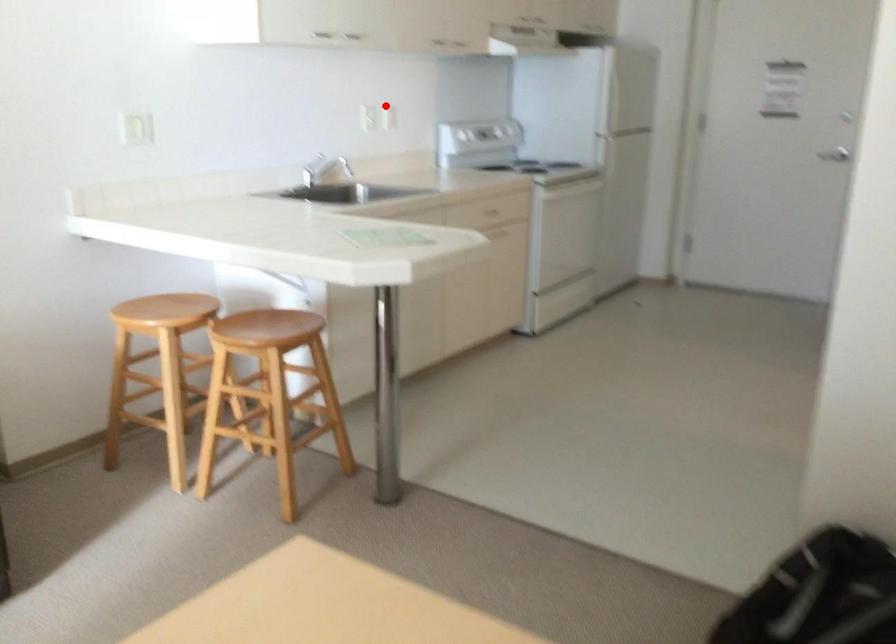
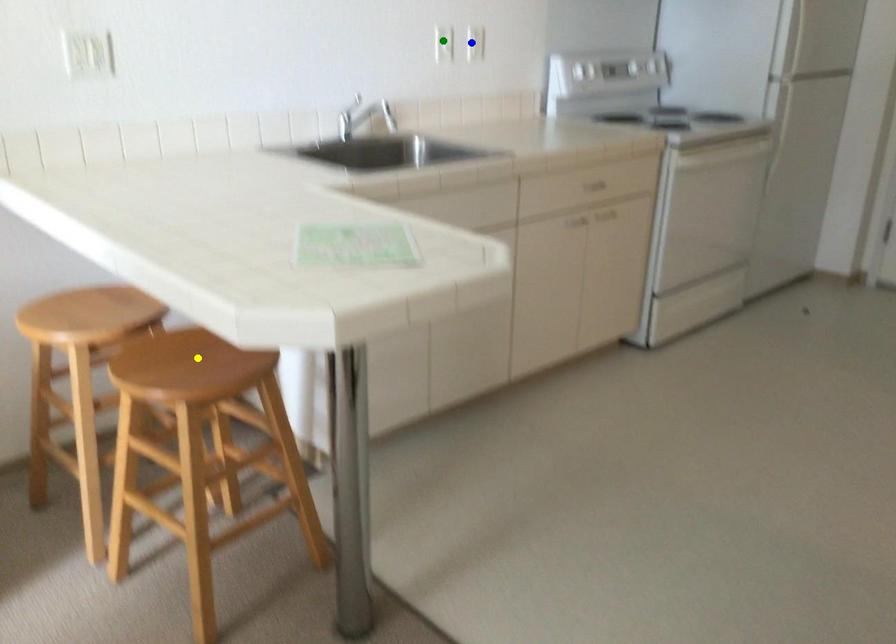
Question: I am providing you with two images of the same scene from different viewpoints. A red point is marked on the first image. You are given multiple points on the second image. Which spot in image 2 lines up with the point in image 1?

Choices:
 (A) green point
 (B) blue point
 (C) yellow point

Answer: (B)